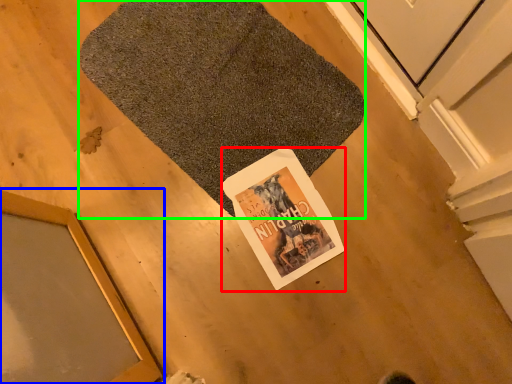
Question: Which is farther away from magazine (highlighted by a red box)? window (highlighted by a blue box) or bath mat (highlighted by a green box)?

Choices:
 (A) window
 (B) bath mat

Answer: (A)